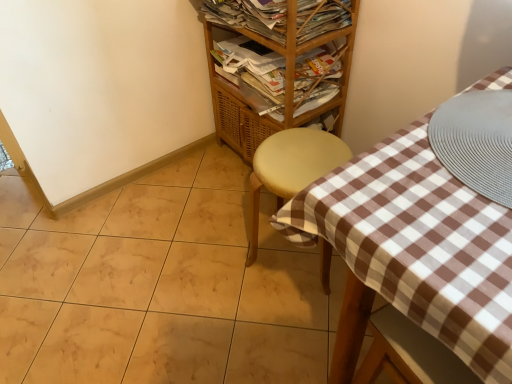
What do you see at coordinates (249, 16) in the screenshot? Image resolution: width=512 pixels, height=384 pixels. I see `wooden magazine rack at upper center, which is the 1th magazine from top to bottom` at bounding box center [249, 16].

What are the coordinates of `wooden magazine at upper center, marked as the 1th magazine in a bottom-to-top arrangement` in the screenshot? It's located at (253, 73).

I want to click on matte yellow stool at center, so click(291, 168).

What are the coordinates of `wooden magazine rack at upper center, which is the 2th magazine from bottom to top` in the screenshot? It's located at (249, 16).

Which of these two, wooden magazine at upper center, marked as the 2th magazine in a top-to-bottom arrangement, or wooden magazine rack at upper center, which is the 1th magazine from top to bottom, is wider?

wooden magazine rack at upper center, which is the 1th magazine from top to bottom.

Is wooden magazine at upper center, marked as the 2th magazine in a top-to-bottom arrangement, positioned far away from wooden magazine rack at upper center, which is the 1th magazine from top to bottom?

They are positioned close to each other.

The height and width of the screenshot is (384, 512). I want to click on magazine that is behind the wooden magazine rack at upper center, which is the 1th magazine from top to bottom, so [x=253, y=73].

Is wooden magazine at upper center, marked as the 1th magazine in a bottom-to-top arrangement, positioned behind wooden magazine rack at upper center, which is the 1th magazine from top to bottom?

Yes, wooden magazine at upper center, marked as the 1th magazine in a bottom-to-top arrangement, is behind wooden magazine rack at upper center, which is the 1th magazine from top to bottom.

Looking at this image, from the image's perspective, between matte yellow stool at center and wooden magazine rack at upper center, which is the 1th magazine from top to bottom, which one is located above?

wooden magazine rack at upper center, which is the 1th magazine from top to bottom, from the image's perspective.

Considering the relative positions of matte yellow stool at center and wooden magazine rack at upper center, which is the 1th magazine from top to bottom, in the image provided, is matte yellow stool at center in front of wooden magazine rack at upper center, which is the 1th magazine from top to bottom,?

That is True.

Is matte yellow stool at center positioned beyond the bounds of wooden magazine rack at upper center, which is the 1th magazine from top to bottom?

matte yellow stool at center is positioned outside wooden magazine rack at upper center, which is the 1th magazine from top to bottom.

Does matte yellow stool at center have a larger size compared to wooden magazine at upper center, marked as the 1th magazine in a bottom-to-top arrangement?

Indeed, matte yellow stool at center has a larger size compared to wooden magazine at upper center, marked as the 1th magazine in a bottom-to-top arrangement.

Measure the distance between matte yellow stool at center and wooden magazine at upper center, marked as the 2th magazine in a top-to-bottom arrangement.

28.51 centimeters.

Considering the relative sizes of matte yellow stool at center and wooden magazine at upper center, marked as the 1th magazine in a bottom-to-top arrangement, in the image provided, is matte yellow stool at center shorter than wooden magazine at upper center, marked as the 1th magazine in a bottom-to-top arrangement,?

Incorrect, the height of matte yellow stool at center does not fall short of that of wooden magazine at upper center, marked as the 1th magazine in a bottom-to-top arrangement.

In the image, is matte yellow stool at center positioned in front of or behind wooden magazine at upper center, marked as the 1th magazine in a bottom-to-top arrangement?

matte yellow stool at center is positioned closer to the viewer than wooden magazine at upper center, marked as the 1th magazine in a bottom-to-top arrangement.

Is wooden magazine rack at upper center, which is the 1th magazine from top to bottom, facing towards wooden/matte shelf at upper center?

Yes, wooden magazine rack at upper center, which is the 1th magazine from top to bottom, is facing wooden/matte shelf at upper center.

Does point (214, 0) lie in front of point (228, 136)?

That is True.

Can you confirm if wooden magazine rack at upper center, which is the 1th magazine from top to bottom, is shorter than wooden/matte shelf at upper center?

Indeed, wooden magazine rack at upper center, which is the 1th magazine from top to bottom, has a lesser height compared to wooden/matte shelf at upper center.

Who is more distant, wooden/matte shelf at upper center or wooden magazine rack at upper center, which is the 2th magazine from bottom to top?

wooden magazine rack at upper center, which is the 2th magazine from bottom to top.

From the image's perspective, is wooden/matte shelf at upper center located beneath wooden magazine rack at upper center, which is the 2th magazine from bottom to top?

Yes, from the image's perspective, wooden/matte shelf at upper center is below wooden magazine rack at upper center, which is the 2th magazine from bottom to top.

Is wooden/matte shelf at upper center outside of wooden magazine rack at upper center, which is the 1th magazine from top to bottom?

Yes.

Which object is further away from the camera taking this photo, wooden/matte shelf at upper center or matte yellow stool at center?

Positioned behind is wooden/matte shelf at upper center.

Can you tell me how much wooden/matte shelf at upper center and matte yellow stool at center differ in facing direction?

The angle between the facing direction of wooden/matte shelf at upper center and the facing direction of matte yellow stool at center is 33.6 degrees.

Is wooden/matte shelf at upper center looking in the opposite direction of matte yellow stool at center?

wooden/matte shelf at upper center is not turned away from matte yellow stool at center.

From the picture: Considering the sizes of objects wooden/matte shelf at upper center and matte yellow stool at center in the image provided, who is taller, wooden/matte shelf at upper center or matte yellow stool at center?

wooden/matte shelf at upper center.

From the image's perspective, relative to wooden magazine at upper center, marked as the 2th magazine in a top-to-bottom arrangement, is wooden magazine rack at upper center, which is the 2th magazine from bottom to top, above or below?

From the image's perspective, wooden magazine rack at upper center, which is the 2th magazine from bottom to top, appears above wooden magazine at upper center, marked as the 2th magazine in a top-to-bottom arrangement.

Locate an element on the screen. The height and width of the screenshot is (384, 512). magazine lying on the left of wooden magazine at upper center, marked as the 1th magazine in a bottom-to-top arrangement is located at coordinates (249, 16).

From a real-world perspective, is wooden magazine rack at upper center, which is the 1th magazine from top to bottom, positioned above or below wooden magazine at upper center, marked as the 1th magazine in a bottom-to-top arrangement?

In terms of real-world spatial position, wooden magazine rack at upper center, which is the 1th magazine from top to bottom, is above wooden magazine at upper center, marked as the 1th magazine in a bottom-to-top arrangement.

Is wooden magazine rack at upper center, which is the 2th magazine from bottom to top, not near wooden magazine at upper center, marked as the 1th magazine in a bottom-to-top arrangement?

They are positioned close to each other.

This screenshot has height=384, width=512. In the image, there is a wooden magazine rack at upper center, which is the 1th magazine from top to bottom. In order to click on magazine below it (from a real-world perspective) in this screenshot , I will do `click(253, 73)`.

From the image's perspective, starting from the matte yellow stool at center, which magazine is the 2nd one above? Please provide its 2D coordinates.

[(249, 16)]

From the image, which object appears to be farther from wooden magazine rack at upper center, which is the 2th magazine from bottom to top, wooden magazine at upper center, marked as the 1th magazine in a bottom-to-top arrangement, or wooden/matte shelf at upper center?

wooden magazine at upper center, marked as the 1th magazine in a bottom-to-top arrangement, lies further to wooden magazine rack at upper center, which is the 2th magazine from bottom to top, than the other object.

Considering their positions, is matte yellow stool at center positioned closer to wooden magazine at upper center, marked as the 1th magazine in a bottom-to-top arrangement, than wooden/matte shelf at upper center?

Among the two, wooden/matte shelf at upper center is located nearer to wooden magazine at upper center, marked as the 1th magazine in a bottom-to-top arrangement.

When comparing their distances from wooden magazine rack at upper center, which is the 2th magazine from bottom to top, does wooden/matte shelf at upper center or matte yellow stool at center seem closer?

Based on the image, wooden/matte shelf at upper center appears to be nearer to wooden magazine rack at upper center, which is the 2th magazine from bottom to top.

When comparing their distances from matte yellow stool at center, does wooden magazine at upper center, marked as the 2th magazine in a top-to-bottom arrangement, or wooden magazine rack at upper center, which is the 1th magazine from top to bottom, seem further?

wooden magazine rack at upper center, which is the 1th magazine from top to bottom, is further to matte yellow stool at center.

Estimate the real-world distances between objects in this image. Which object is closer to wooden/matte shelf at upper center, wooden magazine rack at upper center, which is the 2th magazine from bottom to top, or wooden magazine at upper center, marked as the 2th magazine in a top-to-bottom arrangement?

Among the two, wooden magazine at upper center, marked as the 2th magazine in a top-to-bottom arrangement, is located nearer to wooden/matte shelf at upper center.

Looking at the image, which one is located closer to wooden magazine rack at upper center, which is the 2th magazine from bottom to top, wooden magazine at upper center, marked as the 1th magazine in a bottom-to-top arrangement, or matte yellow stool at center?

wooden magazine at upper center, marked as the 1th magazine in a bottom-to-top arrangement, lies closer to wooden magazine rack at upper center, which is the 2th magazine from bottom to top, than the other object.

From the image, which object appears to be nearer to wooden magazine rack at upper center, which is the 2th magazine from bottom to top, wooden/matte shelf at upper center or wooden magazine at upper center, marked as the 1th magazine in a bottom-to-top arrangement?

wooden/matte shelf at upper center is positioned closer to the anchor wooden magazine rack at upper center, which is the 2th magazine from bottom to top.

From the image, which object appears to be nearer to matte yellow stool at center, wooden magazine rack at upper center, which is the 2th magazine from bottom to top, or wooden magazine at upper center, marked as the 2th magazine in a top-to-bottom arrangement?

wooden magazine at upper center, marked as the 2th magazine in a top-to-bottom arrangement, lies closer to matte yellow stool at center than the other object.

At what (x,y) coordinates should I click in order to perform the action: click on magazine that lies between wooden magazine rack at upper center, which is the 1th magazine from top to bottom, and matte yellow stool at center from top to bottom. Please return your answer as a coordinate pair (x, y). The width and height of the screenshot is (512, 384). Looking at the image, I should click on (253, 73).

Where is `magazine that lies between wooden/matte shelf at upper center and matte yellow stool at center from top to bottom`? Image resolution: width=512 pixels, height=384 pixels. magazine that lies between wooden/matte shelf at upper center and matte yellow stool at center from top to bottom is located at coordinates (253, 73).

This screenshot has height=384, width=512. I want to click on shelf between wooden magazine rack at upper center, which is the 1th magazine from top to bottom, and matte yellow stool at center vertically, so click(277, 66).

Where is `magazine positioned between wooden/matte shelf at upper center and wooden magazine at upper center, marked as the 1th magazine in a bottom-to-top arrangement, from near to far`? The height and width of the screenshot is (384, 512). magazine positioned between wooden/matte shelf at upper center and wooden magazine at upper center, marked as the 1th magazine in a bottom-to-top arrangement, from near to far is located at coordinates (249, 16).